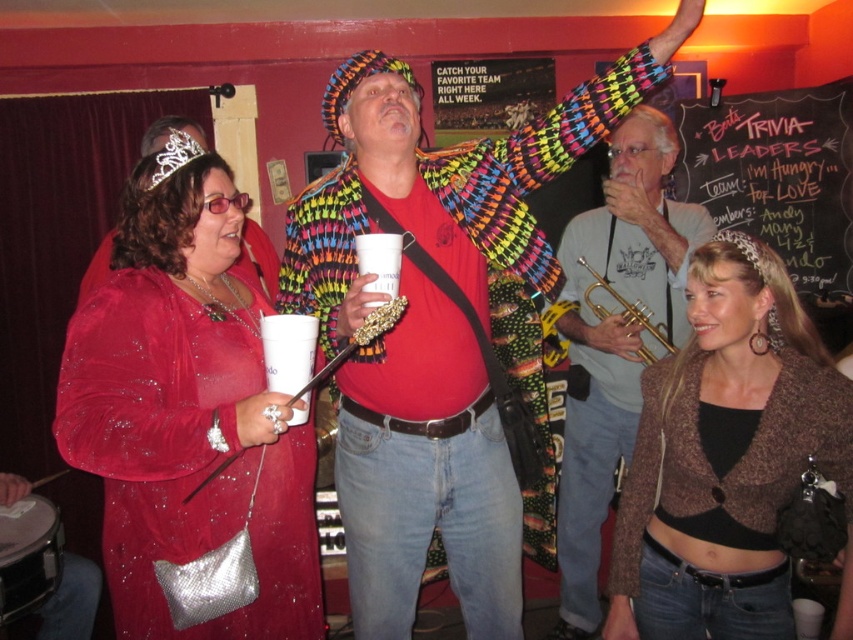
Question: Is knitted multicolored sweater at center below gold shiny trumpet at center?

Choices:
 (A) no
 (B) yes

Answer: (B)

Question: Considering the real-world distances, which object is farthest from the matte gray shirt at center?

Choices:
 (A) metallic silver wand at center
 (B) gold shiny trumpet at center
 (C) knitted multicolored sweater at center
 (D) brushed metal drum at lower left

Answer: (D)

Question: Is knitted multicolored sweater at center below matte gray shirt at center?

Choices:
 (A) no
 (B) yes

Answer: (A)

Question: Among these objects, which one is nearest to the camera?

Choices:
 (A) shiny red dress at center
 (B) gold shiny trumpet at center
 (C) brown tweed jacket at center

Answer: (A)

Question: From the image, what is the correct spatial relationship of brown tweed jacket at center in relation to gold shiny trumpet at center?

Choices:
 (A) below
 (B) above

Answer: (A)

Question: Which point is farther to the camera?

Choices:
 (A) (335, 364)
 (B) (590, 300)
 (C) (21, 608)
 (D) (769, 483)

Answer: (B)